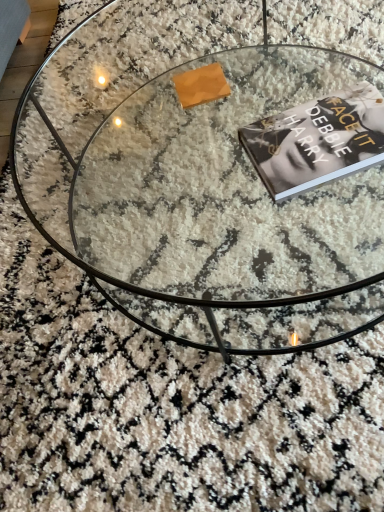
In order to click on vacant space behind black matte book at center in this screenshot , I will do `click(284, 77)`.